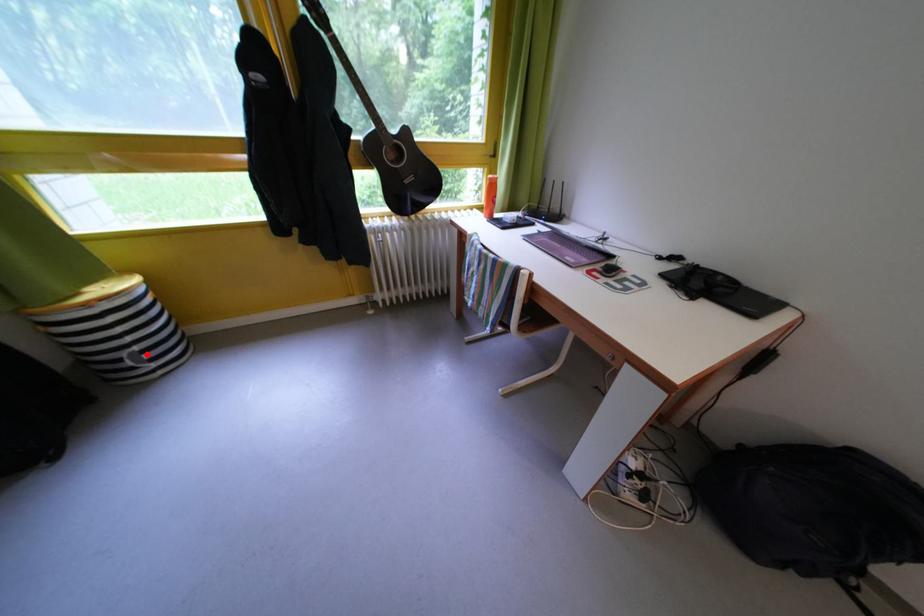
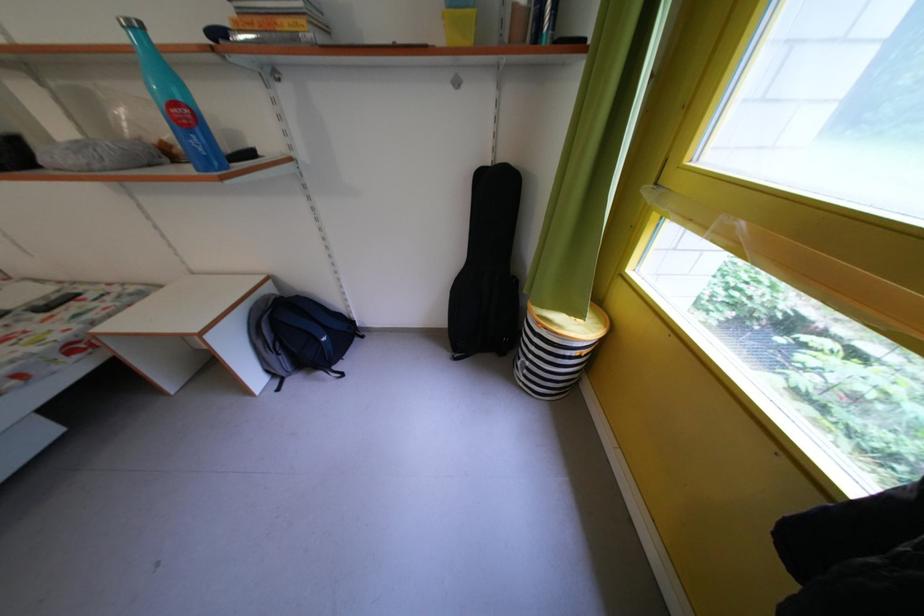
Where in the second image is the point corresponding to the highlighted location from the first image?

(537, 369)